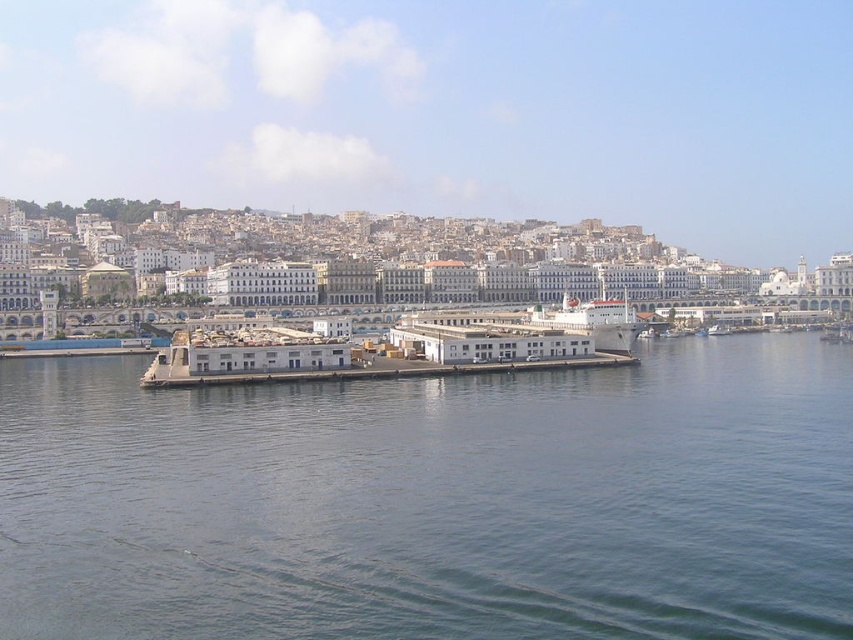
Is gray concrete dock at center taller than white matte dock at center?

Correct, gray concrete dock at center is much taller as white matte dock at center.

Between gray concrete dock at center and white matte dock at center, which one has more height?

Standing taller between the two is gray concrete dock at center.

This screenshot has height=640, width=853. What do you see at coordinates (434, 500) in the screenshot? I see `gray concrete dock at center` at bounding box center [434, 500].

The image size is (853, 640). Identify the location of gray concrete dock at center. (434, 500).